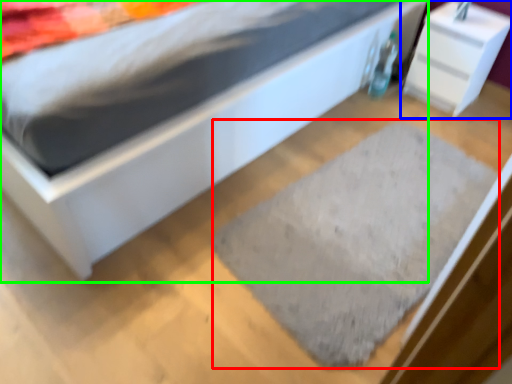
Question: Considering the real-world distances, which object is closest to doormat (highlighted by a red box)? nightstand (highlighted by a blue box) or bed (highlighted by a green box).

Choices:
 (A) nightstand
 (B) bed

Answer: (B)